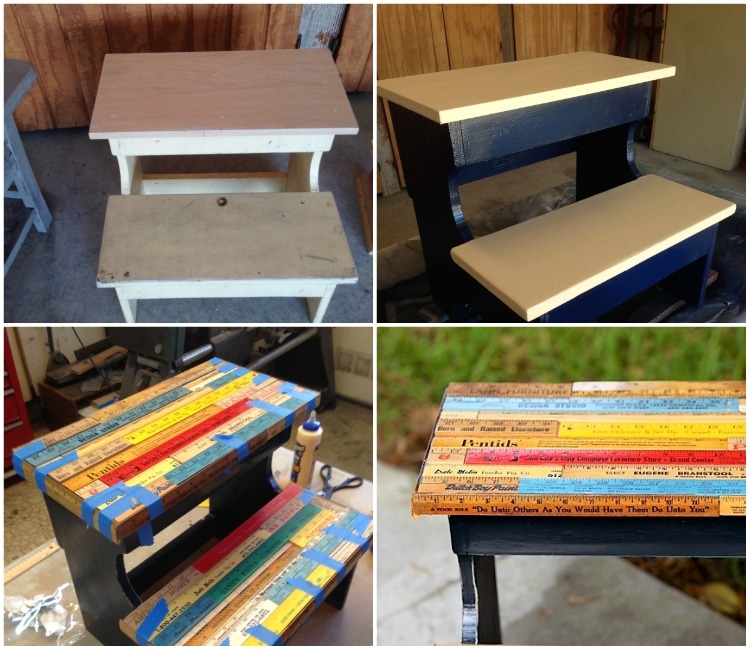
The width and height of the screenshot is (750, 650). What are the coordinates of `unfinished bench` in the screenshot? It's located at (240, 99).